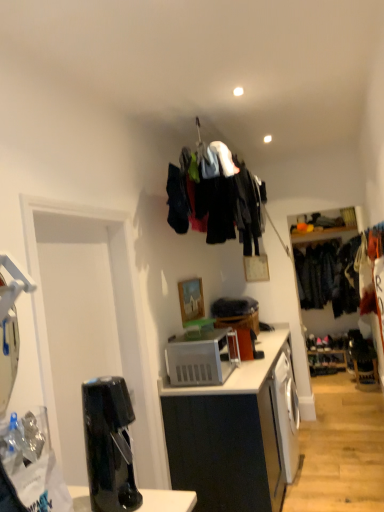
Question: From a real-world perspective, does dark blue fabric at right, which is the first clothing from right to left, sit lower than white plastic microwave oven at center?

Choices:
 (A) no
 (B) yes

Answer: (A)

Question: Can white plastic microwave oven at center be found inside dark blue fabric at right, the second clothing positioned from the left?

Choices:
 (A) no
 (B) yes

Answer: (A)

Question: Is dark blue fabric at right, the 2th clothing in the front-to-back sequence, oriented away from white plastic microwave oven at center?

Choices:
 (A) yes
 (B) no

Answer: (B)

Question: Could you tell me if dark blue fabric at right, positioned as the first clothing in back-to-front order, is facing white plastic microwave oven at center?

Choices:
 (A) yes
 (B) no

Answer: (A)

Question: From the image's perspective, is dark blue fabric at right, which is the first clothing from right to left, located above white plastic microwave oven at center?

Choices:
 (A) no
 (B) yes

Answer: (B)

Question: Does dark blue fabric at right, positioned as the first clothing in back-to-front order, have a larger size compared to white plastic microwave oven at center?

Choices:
 (A) yes
 (B) no

Answer: (A)

Question: From the image's perspective, is black glossy coffee machine at lower left located beneath white plastic microwave oven at center?

Choices:
 (A) yes
 (B) no

Answer: (B)

Question: Could you tell me if black glossy coffee machine at lower left is turned towards white plastic microwave oven at center?

Choices:
 (A) no
 (B) yes

Answer: (A)

Question: Can you confirm if black glossy coffee machine at lower left is smaller than white plastic microwave oven at center?

Choices:
 (A) yes
 (B) no

Answer: (A)

Question: Considering the relative sizes of black glossy coffee machine at lower left and white plastic microwave oven at center in the image provided, is black glossy coffee machine at lower left bigger than white plastic microwave oven at center?

Choices:
 (A) yes
 (B) no

Answer: (B)

Question: Considering the relative positions of black glossy coffee machine at lower left and white plastic microwave oven at center in the image provided, is black glossy coffee machine at lower left to the right of white plastic microwave oven at center from the viewer's perspective?

Choices:
 (A) no
 (B) yes

Answer: (A)

Question: Is black glossy coffee machine at lower left to the left of white plastic microwave oven at center from the viewer's perspective?

Choices:
 (A) no
 (B) yes

Answer: (B)

Question: From a real-world perspective, is dark blue fabric at right, positioned as the first clothing in back-to-front order, on top of white matte cabinet at center?

Choices:
 (A) yes
 (B) no

Answer: (A)